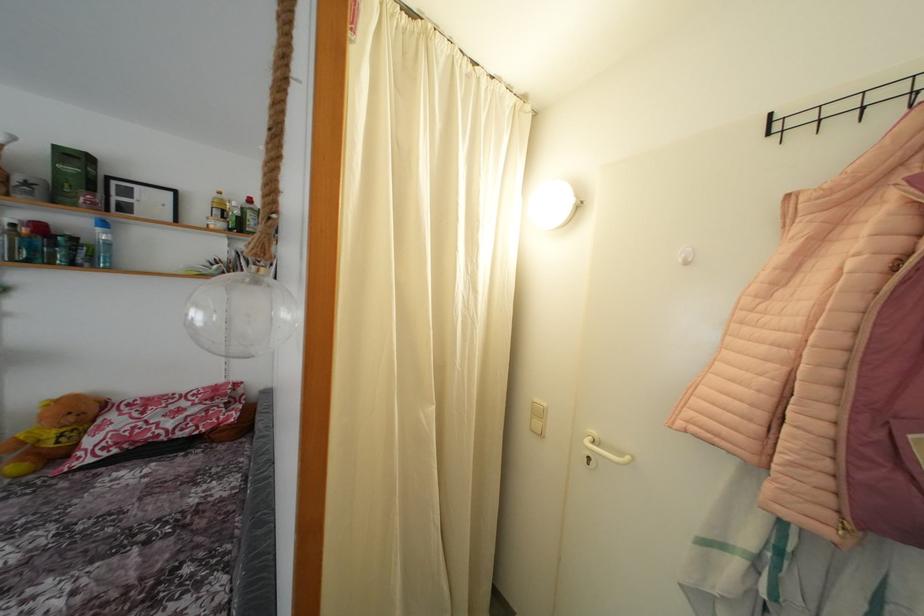
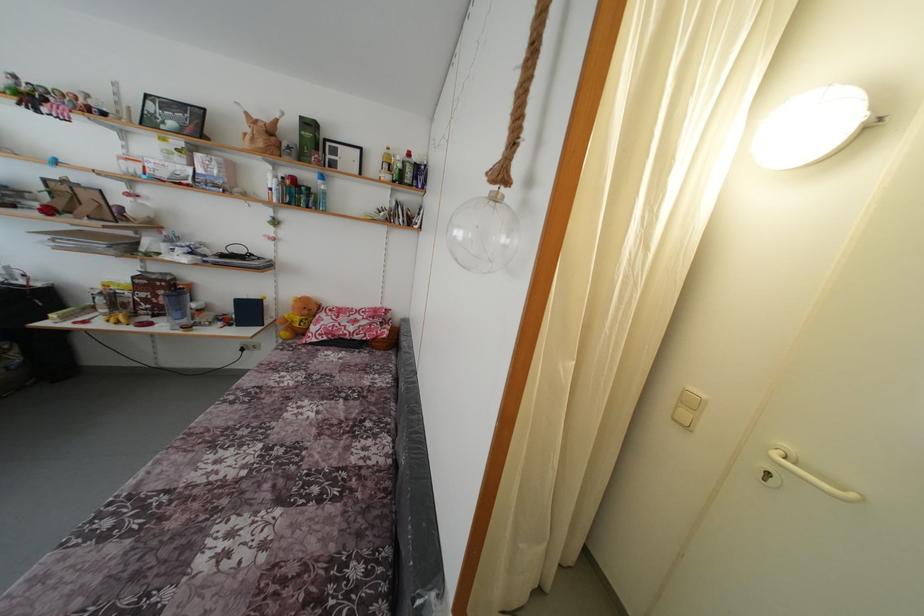
In the second image, find the point that corresponds to (104,236) in the first image.

(324, 188)